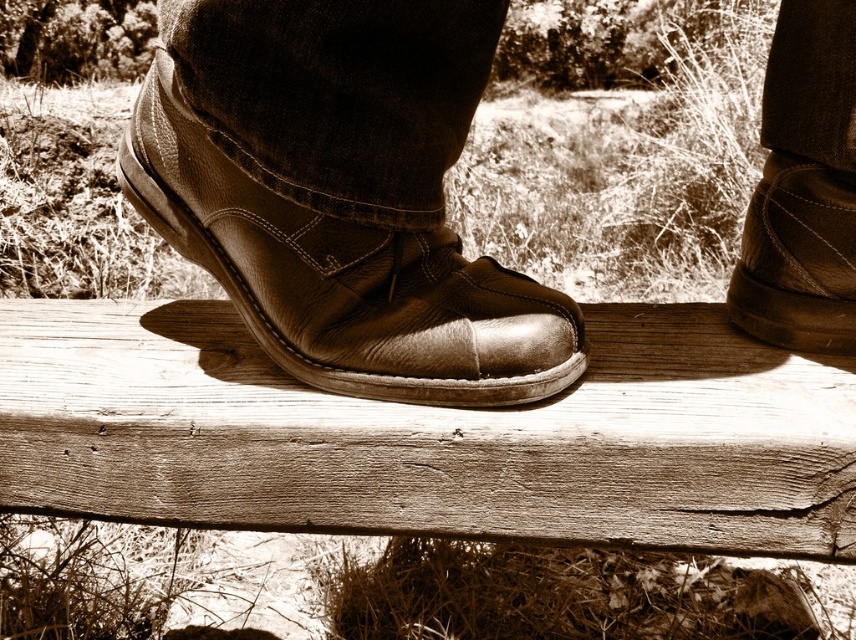
Between shiny brown leather shoe at center and leather boot at right, which one appears on the right side from the viewer's perspective?

leather boot at right is more to the right.

Who is lower down, shiny brown leather shoe at center or leather boot at right?

shiny brown leather shoe at center is lower down.

Who is more forward, (550, 321) or (849, 348)?

Point (550, 321) is more forward.

In order to click on shiny brown leather shoe at center in this screenshot , I will do `click(343, 276)`.